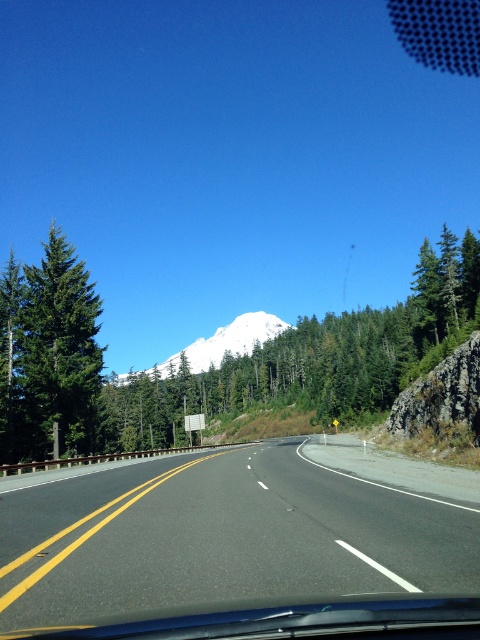
Question: Is green matte tree at left wider than white snow-covered mountain at center?

Choices:
 (A) yes
 (B) no

Answer: (A)

Question: Can you confirm if black asphalt road at center is thinner than transparent glass windshield at center?

Choices:
 (A) yes
 (B) no

Answer: (B)

Question: Among these points, which one is farthest from the camera?

Choices:
 (A) (352, 618)
 (B) (86, 369)
 (C) (360, 525)

Answer: (B)

Question: Which object is the closest to the white snow-covered mountain at center?

Choices:
 (A) transparent glass windshield at center
 (B) green matte tree at left

Answer: (B)

Question: Is black asphalt road at center to the left of white snow-covered mountain at center from the viewer's perspective?

Choices:
 (A) yes
 (B) no

Answer: (B)

Question: Estimate the real-world distances between objects in this image. Which object is farther from the transparent glass windshield at center?

Choices:
 (A) black asphalt road at center
 (B) green matte tree at left

Answer: (B)